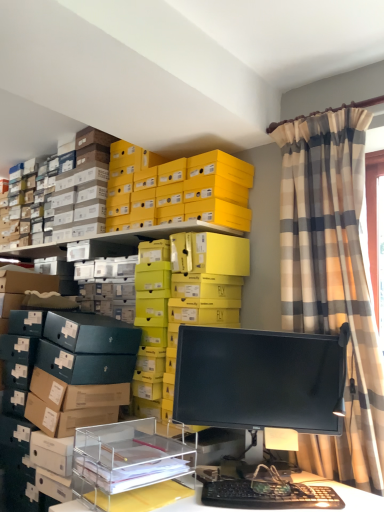
Question: Is yellow cardboard boxes at upper center, the 1th shelf positioned from the back, not inside yellow matte shoebox at upper center?

Choices:
 (A) yes
 (B) no

Answer: (A)

Question: Could you tell me if yellow cardboard boxes at upper center, the second shelf viewed from the front, is turned towards yellow matte shoebox at upper center?

Choices:
 (A) no
 (B) yes

Answer: (A)

Question: From a real-world perspective, is yellow cardboard boxes at upper center, the second shelf viewed from the front, positioned under yellow matte shoebox at upper center based on gravity?

Choices:
 (A) yes
 (B) no

Answer: (A)

Question: Is yellow cardboard boxes at upper center, the 1th shelf positioned from the back, oriented away from yellow matte shoebox at upper center?

Choices:
 (A) no
 (B) yes

Answer: (A)

Question: Is yellow cardboard boxes at upper center, the 1th shelf positioned from the back, thinner than yellow matte shoebox at upper center?

Choices:
 (A) yes
 (B) no

Answer: (B)

Question: Is point (218, 186) positioned closer to the camera than point (210, 498)?

Choices:
 (A) closer
 (B) farther

Answer: (B)

Question: Is yellow matte shoebox at upper center spatially inside black plastic keyboard at lower center, or outside of it?

Choices:
 (A) outside
 (B) inside

Answer: (A)

Question: Relative to black plastic keyboard at lower center, is yellow matte shoebox at upper center in front or behind?

Choices:
 (A) behind
 (B) front

Answer: (A)

Question: Considering the positions of yellow matte shoebox at upper center and black plastic keyboard at lower center in the image, is yellow matte shoebox at upper center taller or shorter than black plastic keyboard at lower center?

Choices:
 (A) tall
 (B) short

Answer: (A)

Question: Considering the positions of plaid fabric curtain at upper right and black plastic keyboard at lower center in the image, is plaid fabric curtain at upper right taller or shorter than black plastic keyboard at lower center?

Choices:
 (A) short
 (B) tall

Answer: (B)

Question: Is plaid fabric curtain at upper right wider or thinner than black plastic keyboard at lower center?

Choices:
 (A) wide
 (B) thin

Answer: (A)

Question: In terms of size, does plaid fabric curtain at upper right appear bigger or smaller than black plastic keyboard at lower center?

Choices:
 (A) small
 (B) big

Answer: (B)

Question: Relative to black plastic keyboard at lower center, is plaid fabric curtain at upper right in front or behind?

Choices:
 (A) front
 (B) behind

Answer: (B)

Question: Visually, is plaid fabric curtain at upper right positioned to the left or to the right of yellow cardboard boxes at upper center, the second shelf viewed from the front?

Choices:
 (A) left
 (B) right

Answer: (B)

Question: Considering the positions of point (375, 446) and point (183, 309), is point (375, 446) closer or farther from the camera than point (183, 309)?

Choices:
 (A) farther
 (B) closer

Answer: (B)